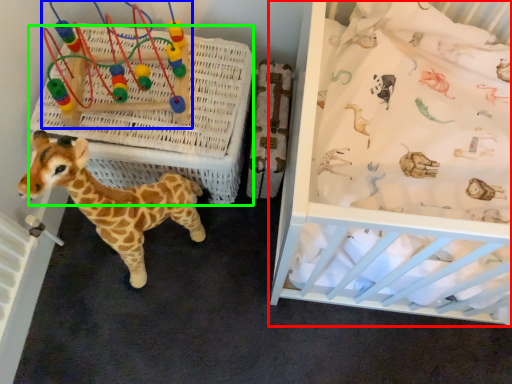
Question: Which is farther away from infant bed (highlighted by a red box)? toy (highlighted by a blue box) or crate (highlighted by a green box)?

Choices:
 (A) toy
 (B) crate

Answer: (A)